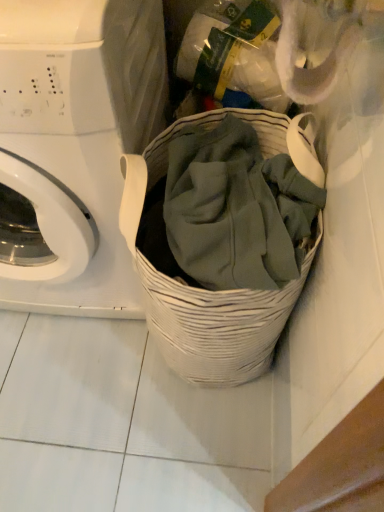
Question: Looking at their shapes, would you say white glossy washing machine at left is wider or thinner than white woven basket at center?

Choices:
 (A) wide
 (B) thin

Answer: (A)

Question: Based on their sizes in the image, would you say white glossy washing machine at left is bigger or smaller than white woven basket at center?

Choices:
 (A) big
 (B) small

Answer: (A)

Question: From a real-world perspective, is white glossy washing machine at left above or below white woven basket at center?

Choices:
 (A) above
 (B) below

Answer: (A)

Question: Is white woven basket at center to the left or to the right of white glossy washing machine at left in the image?

Choices:
 (A) right
 (B) left

Answer: (A)

Question: From a real-world perspective, is white woven basket at center above or below white glossy washing machine at left?

Choices:
 (A) above
 (B) below

Answer: (B)

Question: From the image's perspective, relative to white glossy washing machine at left, is white woven basket at center above or below?

Choices:
 (A) below
 (B) above

Answer: (A)

Question: Based on their sizes in the image, would you say white woven basket at center is bigger or smaller than white glossy washing machine at left?

Choices:
 (A) big
 (B) small

Answer: (B)